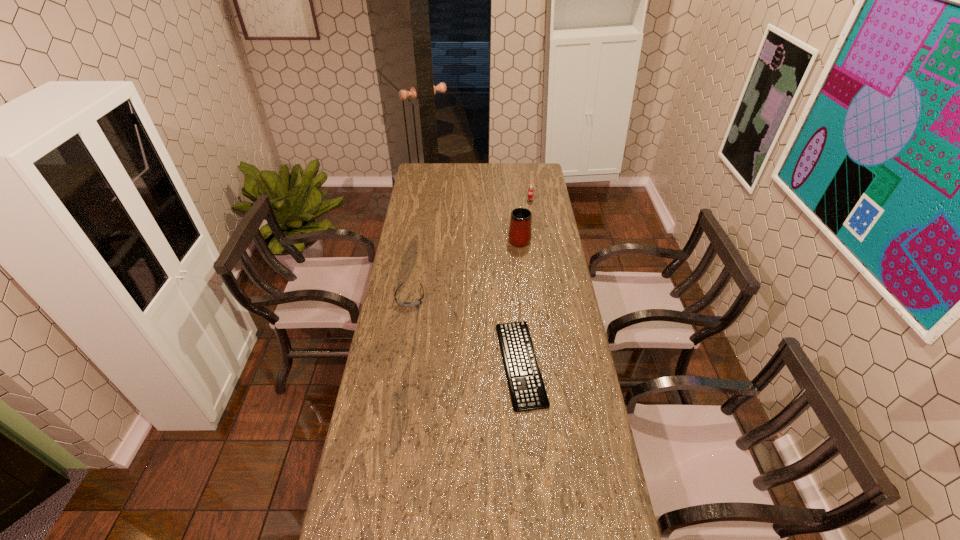
Image resolution: width=960 pixels, height=540 pixels. Find the location of `the second farthest object`. the second farthest object is located at coordinates (520, 234).

The width and height of the screenshot is (960, 540). In order to click on mug in this screenshot , I will do `click(520, 234)`.

You are a GUI agent. You are given a task and a screenshot of the screen. Output one action in this format:
    pyautogui.click(x=<x>, y=<y>)
    Task: Click on the third shortest object
    
    Given the screenshot: What is the action you would take?
    pyautogui.click(x=530, y=192)

I want to click on the rightmost object, so click(530, 192).

Locate an element on the screen. sunglasses is located at coordinates (403, 304).

Identify the location of the third farthest object. (403, 304).

Locate an element on the screen. The image size is (960, 540). the nearest object is located at coordinates (526, 386).

Locate an element on the screen. The height and width of the screenshot is (540, 960). computer keyboard is located at coordinates (526, 386).

Find the location of a particular element. The width and height of the screenshot is (960, 540). vacant space located 0.380m on the side of the third nearest object with the handle is located at coordinates (514, 187).

Identify the location of free space located 0.340m on the side of the third nearest object with the handle. (515, 191).